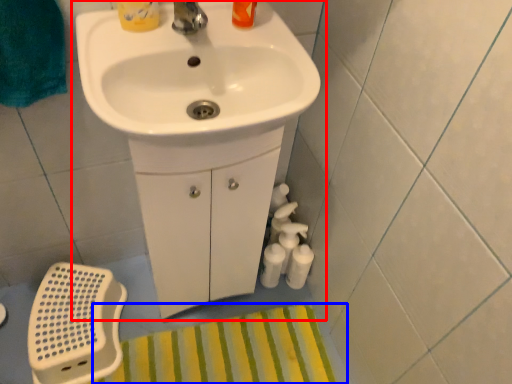
Question: Which point is closer to the camera, sink (highlighted by a red box) or bath mat (highlighted by a blue box)?

Choices:
 (A) sink
 (B) bath mat

Answer: (A)